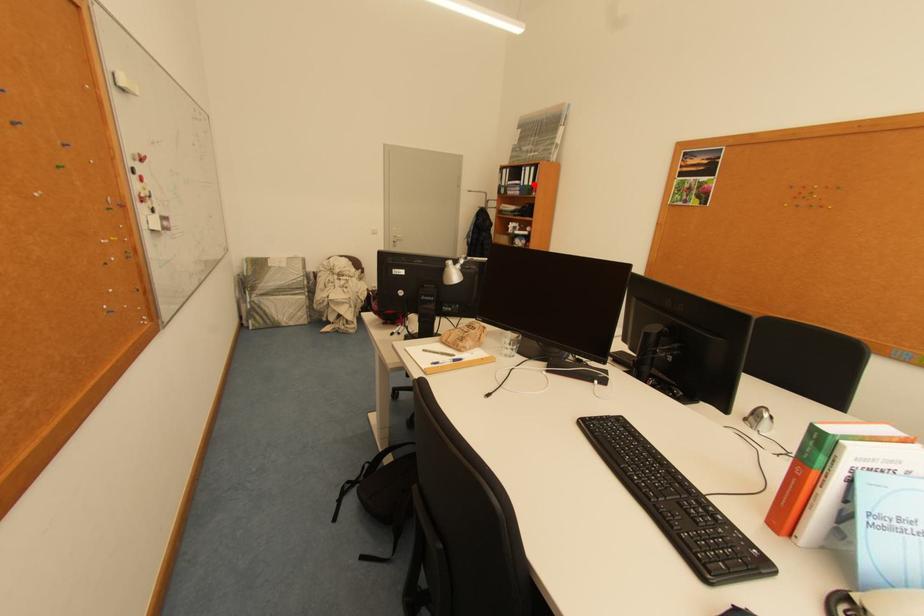
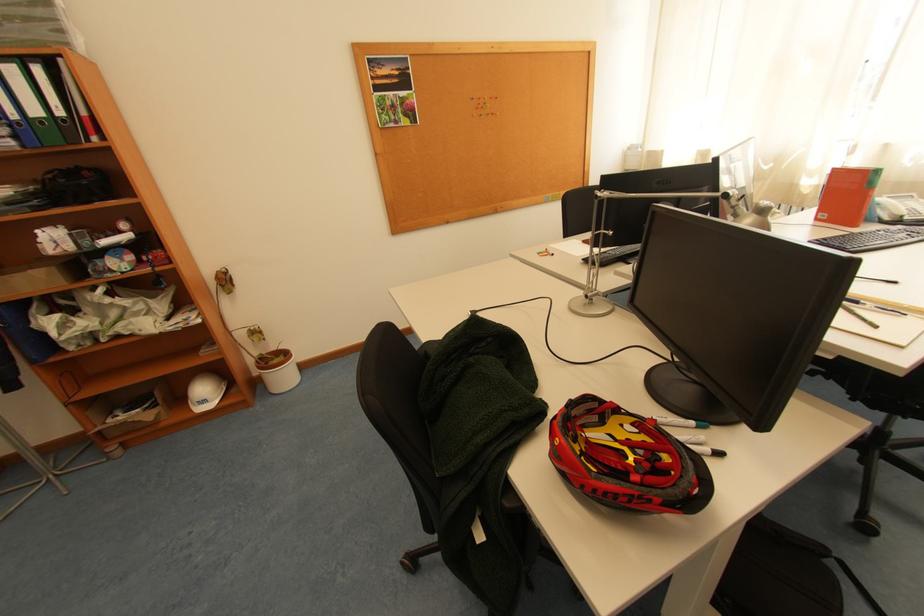
Locate, in the second image, the point that corresponds to the highlighted location in the first image.

(44, 113)